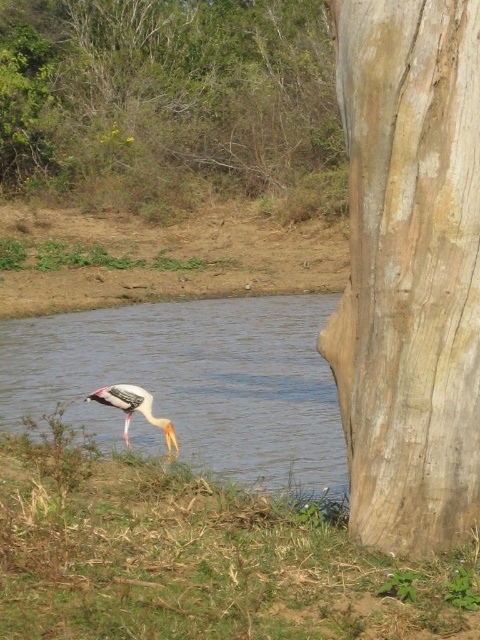
Can you confirm if smooth brown water at lower left is bigger than painted wood stork at lower left?

Indeed, smooth brown water at lower left has a larger size compared to painted wood stork at lower left.

Is point (251, 445) positioned before point (99, 400)?

That is False.

Locate an element on the screen. The width and height of the screenshot is (480, 640). smooth brown water at lower left is located at coordinates (193, 381).

Which is above, light brown rough bark at right or green grass at lower left?

light brown rough bark at right is above.

Who is shorter, light brown rough bark at right or green grass at lower left?

Standing shorter between the two is green grass at lower left.

Who is more forward, (356, 499) or (62, 456)?

Point (356, 499) is more forward.

Locate an element on the screen. The height and width of the screenshot is (640, 480). light brown rough bark at right is located at coordinates (409, 269).

Is point (375, 481) positioned in front of point (129, 147)?

Yes.

Does light brown rough bark at right appear on the left side of brown rough tree at upper left?

No, light brown rough bark at right is not to the left of brown rough tree at upper left.

Which is behind, point (374, 260) or point (297, 140)?

The point (297, 140) is behind.

You are a GUI agent. You are given a task and a screenshot of the screen. Output one action in this format:
    pyautogui.click(x=<x>, y=<y>)
    Task: Click on the light brown rough bark at right
    
    Given the screenshot: What is the action you would take?
    pyautogui.click(x=409, y=269)